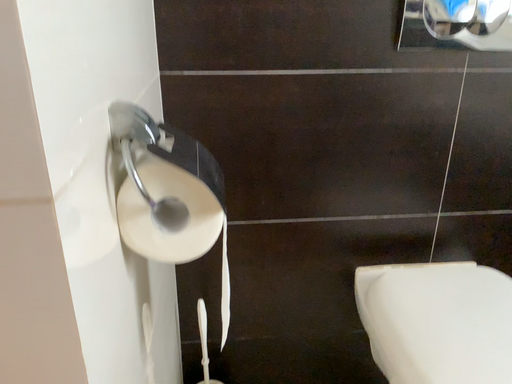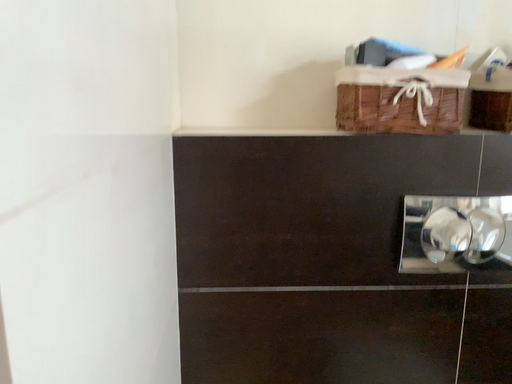
Question: Which way did the camera rotate in the video?

Choices:
 (A) rotated upward
 (B) rotated downward

Answer: (A)